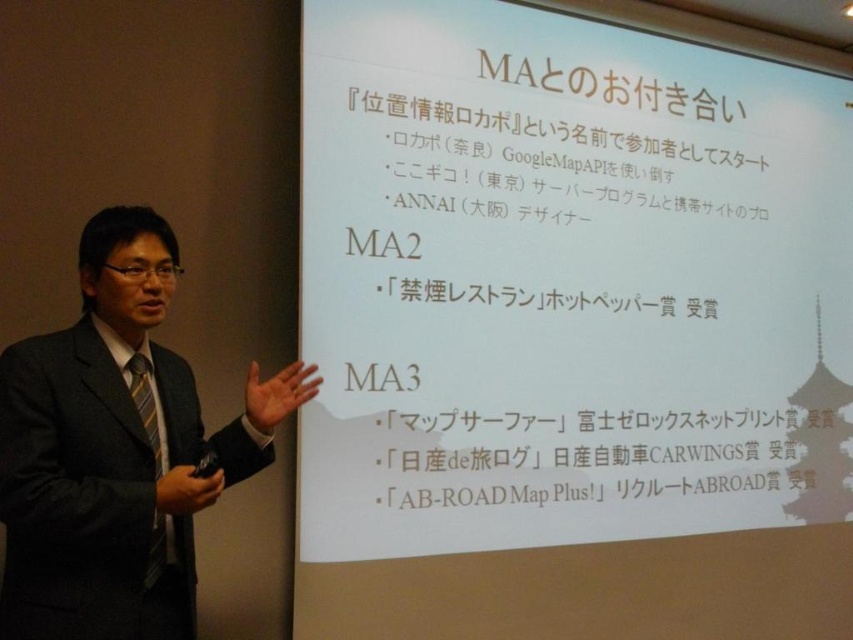
You are an attendee at the presentation. You notice two items in the scene that might be important for taking notes. Which item is taller, the white paper at upper center or the dark gray suit at left?

The white paper at upper center has a greater height compared to the dark gray suit at left, so the white paper at upper center is taller.

You are an attendee at this presentation. You notice the white paper at upper center and the dark gray suit at left. Which object is positioned higher in the image?

The white paper at upper center is positioned higher than the dark gray suit at left.